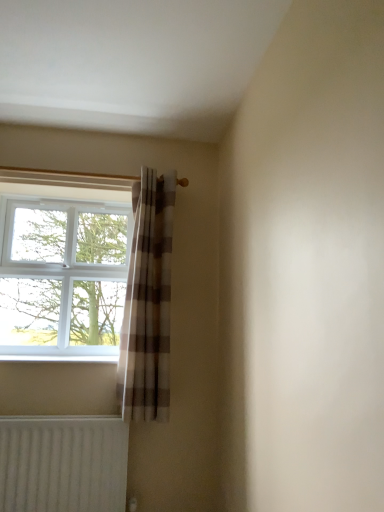
Question: Is white ribbed radiator at lower left in front of plaid fabric curtain at center?

Choices:
 (A) no
 (B) yes

Answer: (B)

Question: Would you consider white ribbed radiator at lower left to be distant from plaid fabric curtain at center?

Choices:
 (A) yes
 (B) no

Answer: (B)

Question: Considering the relative positions of white ribbed radiator at lower left and plaid fabric curtain at center in the image provided, is white ribbed radiator at lower left to the left of plaid fabric curtain at center from the viewer's perspective?

Choices:
 (A) yes
 (B) no

Answer: (A)

Question: Considering the relative sizes of white ribbed radiator at lower left and plaid fabric curtain at center in the image provided, is white ribbed radiator at lower left wider than plaid fabric curtain at center?

Choices:
 (A) no
 (B) yes

Answer: (A)

Question: Is white ribbed radiator at lower left further to the viewer compared to plaid fabric curtain at center?

Choices:
 (A) yes
 (B) no

Answer: (B)

Question: Is white plastic window at left inside or outside of white ribbed radiator at lower left?

Choices:
 (A) inside
 (B) outside

Answer: (B)

Question: From a real-world perspective, is white plastic window at left positioned above or below white ribbed radiator at lower left?

Choices:
 (A) below
 (B) above

Answer: (B)

Question: Is white plastic window at left to the left or to the right of white ribbed radiator at lower left in the image?

Choices:
 (A) left
 (B) right

Answer: (A)

Question: Does point (1, 244) appear closer or farther from the camera than point (31, 504)?

Choices:
 (A) farther
 (B) closer

Answer: (A)

Question: Would you say plaid fabric curtain at center is inside or outside white ribbed radiator at lower left?

Choices:
 (A) outside
 (B) inside

Answer: (A)

Question: From the image's perspective, is plaid fabric curtain at center positioned above or below white ribbed radiator at lower left?

Choices:
 (A) below
 (B) above

Answer: (B)

Question: Considering the positions of plaid fabric curtain at center and white ribbed radiator at lower left in the image, is plaid fabric curtain at center wider or thinner than white ribbed radiator at lower left?

Choices:
 (A) wide
 (B) thin

Answer: (A)

Question: From a real-world perspective, is plaid fabric curtain at center physically located above or below white ribbed radiator at lower left?

Choices:
 (A) below
 (B) above

Answer: (B)

Question: Is white ribbed radiator at lower left spatially inside plaid fabric curtain at center, or outside of it?

Choices:
 (A) outside
 (B) inside

Answer: (A)

Question: In the image, is white ribbed radiator at lower left positioned in front of or behind plaid fabric curtain at center?

Choices:
 (A) front
 (B) behind

Answer: (A)